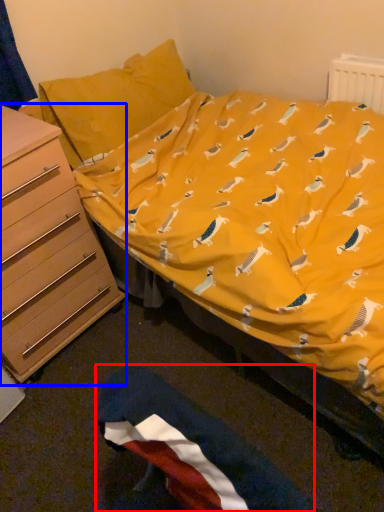
Question: Which object appears closest to the camera in this image, flag (highlighted by a red box) or chest of drawers (highlighted by a blue box)?

Choices:
 (A) flag
 (B) chest of drawers

Answer: (A)